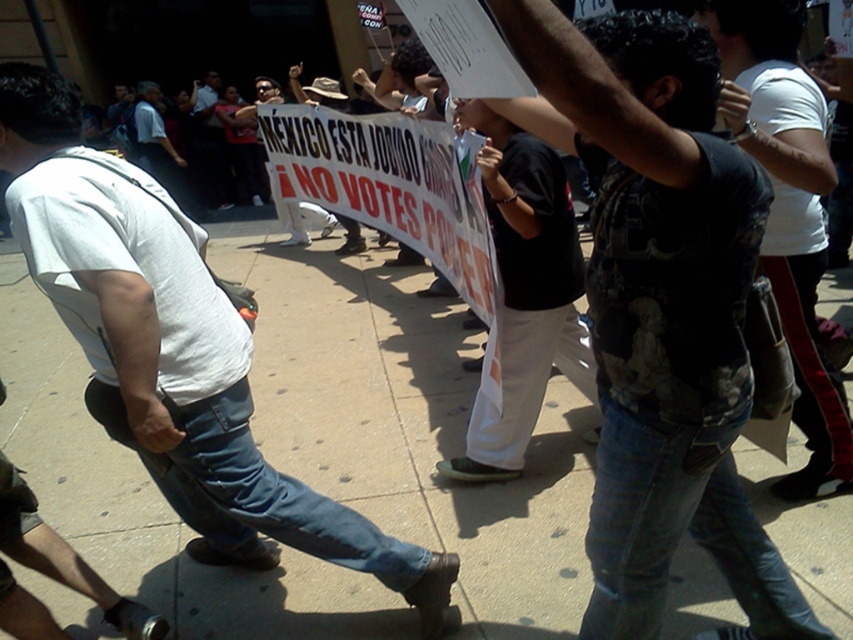
Who is positioned more to the left, dark printed t-shirt at center or white t-shirt at center?

white t-shirt at center is more to the left.

Does dark printed t-shirt at center appear under white t-shirt at center?

No, dark printed t-shirt at center is not below white t-shirt at center.

Which is in front, point (653, 216) or point (80, 275)?

Positioned in front is point (653, 216).

The height and width of the screenshot is (640, 853). I want to click on dark printed t-shirt at center, so click(x=659, y=307).

Which is above, smooth concrete sidewalk at center or white t-shirt at center?

white t-shirt at center is above.

Between smooth concrete sidewalk at center and white t-shirt at center, which one appears on the left side from the viewer's perspective?

From the viewer's perspective, white t-shirt at center appears more on the left side.

Is point (447, 314) positioned behind point (196, 269)?

That is True.

Locate an element on the screen. smooth concrete sidewalk at center is located at coordinates (410, 428).

Who is positioned more to the right, dark printed t-shirt at center or dark gray t-shirt at center?

dark gray t-shirt at center

Does dark printed t-shirt at center come in front of dark gray t-shirt at center?

That is True.

Is point (630, 140) more distant than point (717, 38)?

No, it is in front of (717, 38).

The image size is (853, 640). What are the coordinates of `dark printed t-shirt at center` in the screenshot? It's located at (659, 307).